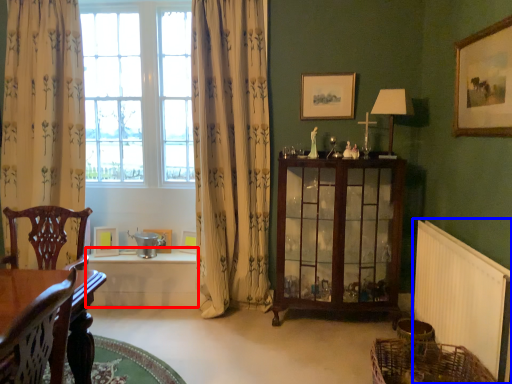
Question: Among these objects, which one is farthest to the camera, table (highlighted by a red box) or radiator (highlighted by a blue box)?

Choices:
 (A) table
 (B) radiator

Answer: (A)